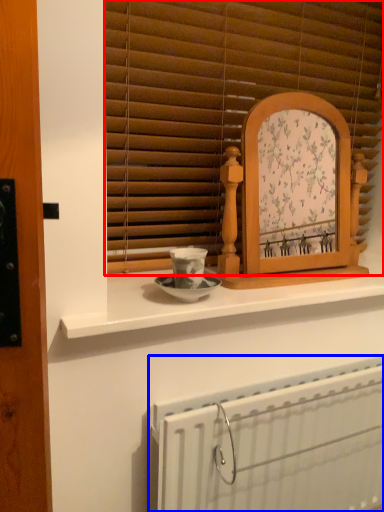
Question: Among these objects, which one is nearest to the camera, window blind (highlighted by a red box) or radiator (highlighted by a blue box)?

Choices:
 (A) window blind
 (B) radiator

Answer: (B)